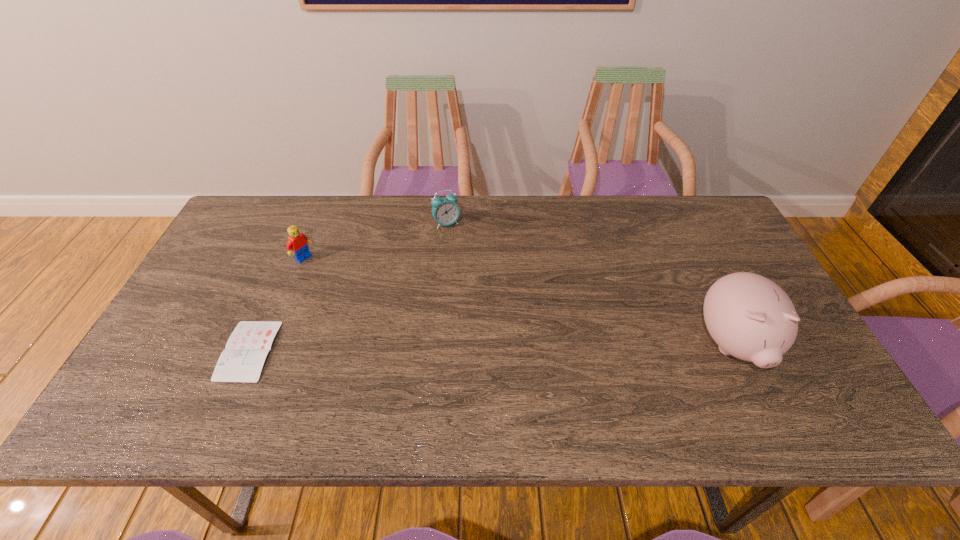
This screenshot has width=960, height=540. I want to click on blank region between the alarm clock and the tallest object, so click(589, 284).

Locate an element on the screen. vacant space in between the second farthest object and the diary is located at coordinates (276, 304).

Identify the location of empty space between the alarm clock and the third nearest object. (375, 241).

At what (x,y) coordinates should I click in order to perform the action: click on empty space between the Lego and the shortest object. Please return your answer as a coordinate pair (x, y). Looking at the image, I should click on (276, 304).

Locate an element on the screen. The height and width of the screenshot is (540, 960). free space between the piggy bank and the third nearest object is located at coordinates (518, 301).

Identify which object is located as the third nearest to the rightmost object. Please provide its 2D coordinates. Your answer should be formatted as a tuple, i.e. [(x, y)], where the tuple contains the x and y coordinates of a point satisfying the conditions above.

[(242, 360)]

Select which object appears as the third closest to the diary. Please provide its 2D coordinates. Your answer should be formatted as a tuple, i.e. [(x, y)], where the tuple contains the x and y coordinates of a point satisfying the conditions above.

[(750, 317)]

Locate an element on the screen. Image resolution: width=960 pixels, height=540 pixels. vacant space that satisfies the following two spatial constraints: 1. on the back side of the farthest object; 2. on the left side of the Lego is located at coordinates (317, 224).